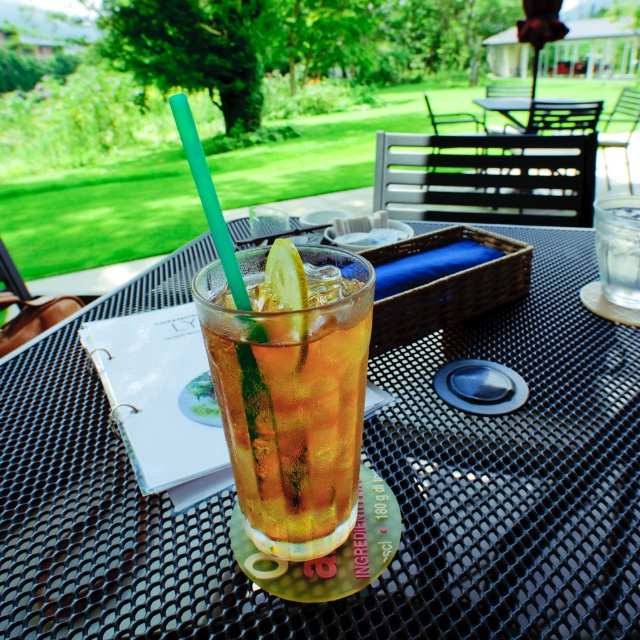
Can you confirm if black mesh table at center is positioned above translucent glass at center?

Indeed, black mesh table at center is positioned over translucent glass at center.

Does black mesh table at center appear on the right side of translucent glass at center?

Indeed, black mesh table at center is positioned on the right side of translucent glass at center.

Is point (483, 339) closer to viewer compared to point (272, 436)?

No, it is not.

Find the location of `black mesh table at center`. black mesh table at center is located at coordinates click(371, 467).

Between green translucent lemon at center and black metal table at center, which one has more height?

black metal table at center

Image resolution: width=640 pixels, height=640 pixels. Identify the location of green translucent lemon at center. [285, 275].

Where is `green translucent lemon at center`? This screenshot has width=640, height=640. green translucent lemon at center is located at coordinates (285, 275).

Can you confirm if black mesh table at center is thinner than black metal table at center?

No, black mesh table at center is not thinner than black metal table at center.

Is black mesh table at center positioned before black metal table at center?

Yes, it is.

Measure the distance between black mesh table at center and camera.

black mesh table at center and camera are 9.27 inches apart from each other.

Locate an element on the screen. black mesh table at center is located at coordinates (371, 467).